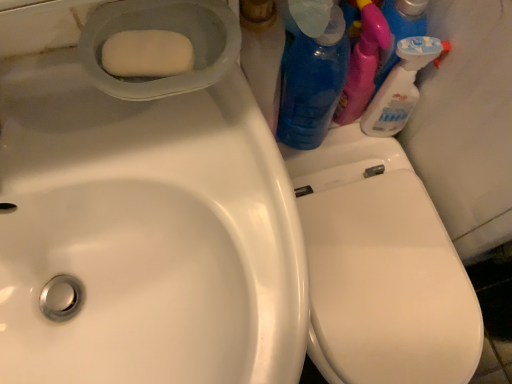
Question: Is white matte soap at upper left in contact with blue translucent bottle at upper right, marked as the 1th cleaning product in a left-to-right arrangement?

Choices:
 (A) no
 (B) yes

Answer: (A)

Question: Considering the relative positions of white matte soap at upper left and blue translucent bottle at upper right, marked as the 1th cleaning product in a left-to-right arrangement, in the image provided, is white matte soap at upper left behind blue translucent bottle at upper right, marked as the 1th cleaning product in a left-to-right arrangement,?

Choices:
 (A) no
 (B) yes

Answer: (A)

Question: Are white matte soap at upper left and blue translucent bottle at upper right, marked as the 1th cleaning product in a left-to-right arrangement, located far from each other?

Choices:
 (A) yes
 (B) no

Answer: (B)

Question: Does white matte soap at upper left have a smaller size compared to blue translucent bottle at upper right, marked as the 1th cleaning product in a left-to-right arrangement?

Choices:
 (A) no
 (B) yes

Answer: (B)

Question: Is white matte soap at upper left surrounding blue translucent bottle at upper right, marked as the 1th cleaning product in a left-to-right arrangement?

Choices:
 (A) no
 (B) yes

Answer: (A)

Question: Is white glossy spray bottle at upper right, acting as the second cleaning product starting from the left, in front of or behind white glossy sink at upper left in the image?

Choices:
 (A) behind
 (B) front

Answer: (A)

Question: Visually, is white glossy spray bottle at upper right, which is counted as the 1th cleaning product, starting from the right, positioned to the left or to the right of white glossy sink at upper left?

Choices:
 (A) right
 (B) left

Answer: (A)

Question: Does point (397, 87) appear closer or farther from the camera than point (132, 299)?

Choices:
 (A) closer
 (B) farther

Answer: (B)

Question: Is white glossy spray bottle at upper right, which is counted as the 1th cleaning product, starting from the right, wider or thinner than white glossy sink at upper left?

Choices:
 (A) thin
 (B) wide

Answer: (A)

Question: From a real-world perspective, is blue translucent bottle at upper right, acting as the second cleaning product starting from the right, physically located above or below white glossy sink at upper left?

Choices:
 (A) below
 (B) above

Answer: (A)

Question: Considering the positions of blue translucent bottle at upper right, marked as the 1th cleaning product in a left-to-right arrangement, and white glossy sink at upper left in the image, is blue translucent bottle at upper right, marked as the 1th cleaning product in a left-to-right arrangement, wider or thinner than white glossy sink at upper left?

Choices:
 (A) thin
 (B) wide

Answer: (A)

Question: Considering the positions of blue translucent bottle at upper right, marked as the 1th cleaning product in a left-to-right arrangement, and white glossy sink at upper left in the image, is blue translucent bottle at upper right, marked as the 1th cleaning product in a left-to-right arrangement, taller or shorter than white glossy sink at upper left?

Choices:
 (A) tall
 (B) short

Answer: (A)

Question: Relative to white glossy sink at upper left, is blue translucent bottle at upper right, marked as the 1th cleaning product in a left-to-right arrangement, in front or behind?

Choices:
 (A) behind
 (B) front

Answer: (A)

Question: Would you say blue translucent bottle at upper right, acting as the second cleaning product starting from the right, is to the left or to the right of white glossy spray bottle at upper right, which is counted as the 1th cleaning product, starting from the right, in the picture?

Choices:
 (A) left
 (B) right

Answer: (A)

Question: From the image's perspective, is blue translucent bottle at upper right, marked as the 1th cleaning product in a left-to-right arrangement, positioned above or below white glossy spray bottle at upper right, which is counted as the 1th cleaning product, starting from the right?

Choices:
 (A) below
 (B) above

Answer: (B)